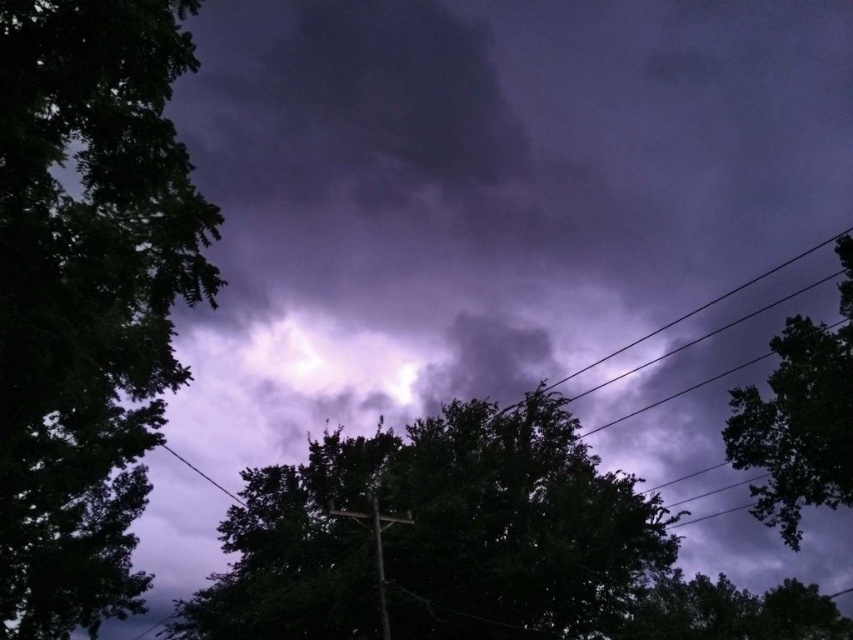
Question: Which is farther from the green leafy tree at lower right?

Choices:
 (A) dark green leafy tree at center
 (B) green leafy tree at left

Answer: (B)

Question: Is the position of green leafy tree at left less distant than that of dark green leafy tree at center?

Choices:
 (A) yes
 (B) no

Answer: (A)

Question: Does dark green leafy tree at center have a smaller size compared to metallic gray telegraph pole at center?

Choices:
 (A) no
 (B) yes

Answer: (A)

Question: Among these objects, which one is farthest from the camera?

Choices:
 (A) metallic gray telegraph pole at center
 (B) green leafy tree at right
 (C) green leafy tree at lower right
 (D) dark green leafy tree at center

Answer: (C)

Question: Which of these objects is positioned closest to the green leafy tree at right?

Choices:
 (A) dark green leafy tree at center
 (B) green leafy tree at left
 (C) metallic gray telegraph pole at center

Answer: (A)

Question: Observing the image, what is the correct spatial positioning of green leafy tree at left in reference to dark green leafy tree at center?

Choices:
 (A) above
 (B) below

Answer: (A)